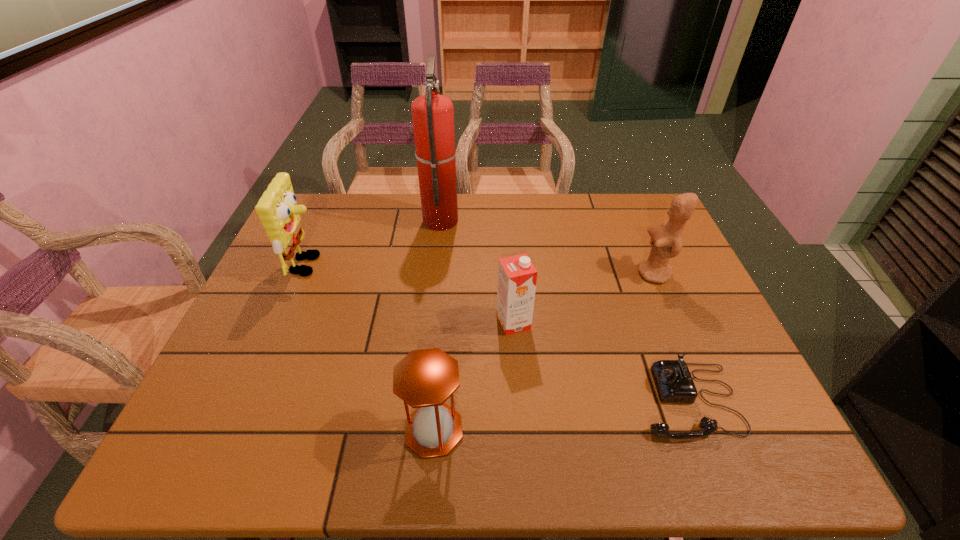
The image size is (960, 540). Find the location of `vacant space located 0.110m on the front-facing side of the figurine`. vacant space located 0.110m on the front-facing side of the figurine is located at coordinates (599, 274).

Identify the location of free space located on the front-facing side of the figurine. (531, 274).

Find the location of a particular element. This screenshot has width=960, height=540. free location located 0.080m on the face of the leftmost object is located at coordinates (x=351, y=265).

Locate an element on the screen. Image resolution: width=960 pixels, height=540 pixels. vacant space located on the front of the fourth farthest object is located at coordinates (519, 405).

Where is `free spot located 0.220m on the right of the hourglass`? The image size is (960, 540). free spot located 0.220m on the right of the hourglass is located at coordinates (571, 430).

Locate an element on the screen. vacant space situated on the dial of the shortest object is located at coordinates pyautogui.click(x=611, y=400).

You are a GUI agent. You are given a task and a screenshot of the screen. Output one action in this format:
    pyautogui.click(x=<x>, y=<y>)
    Task: Click on the vacant space located 0.180m on the dial of the shortest object
    The image size is (960, 540).
    Given the screenshot: What is the action you would take?
    pyautogui.click(x=555, y=400)

Locate an element on the screen. vacant space located 0.150m on the dial of the shortest object is located at coordinates (568, 400).

You are a GUI agent. You are given a task and a screenshot of the screen. Output one action in this format:
    pyautogui.click(x=<x>, y=<y>)
    Task: Click on the object located in the far edge section of the desktop
    
    Given the screenshot: What is the action you would take?
    pyautogui.click(x=433, y=114)

Where is `hourglass at the near edge`? hourglass at the near edge is located at coordinates (424, 379).